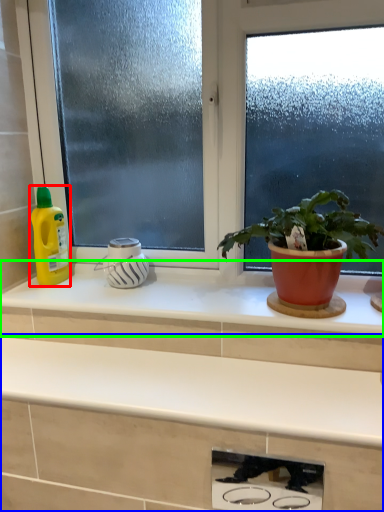
Question: Based on their relative distances, which object is nearer to cleaning product (highlighted by a red box)? Choose from countertop (highlighted by a blue box) and countertop (highlighted by a green box).

Choices:
 (A) countertop
 (B) countertop

Answer: (B)